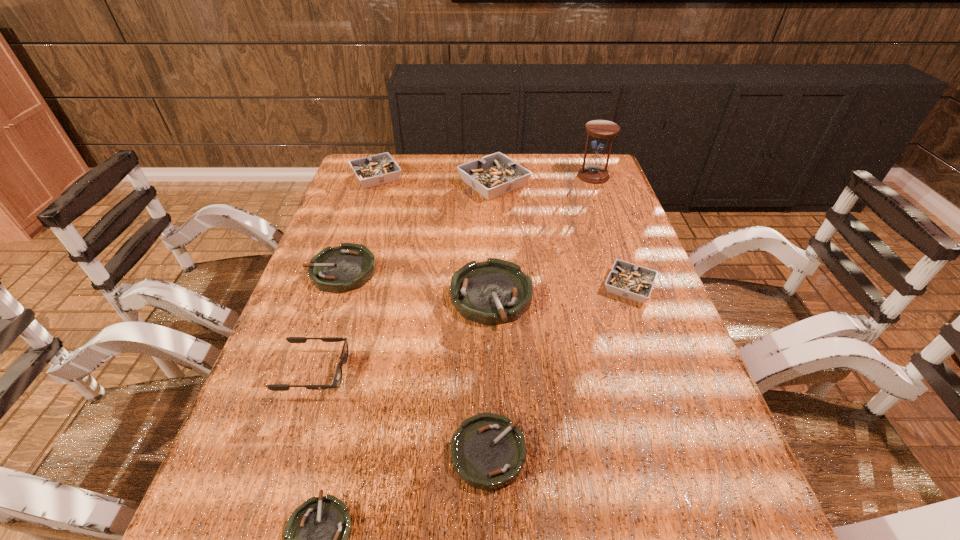
Find the location of a particular element. The height and width of the screenshot is (540, 960). hourglass at the right edge is located at coordinates (593, 172).

At what (x,y) coordinates should I click in order to perform the action: click on ashtray present at the right edge. Please return your answer as a coordinate pair (x, y). Looking at the image, I should click on (627, 280).

This screenshot has height=540, width=960. What are the coordinates of `object positioned at the far left corner` in the screenshot? It's located at (378, 169).

This screenshot has width=960, height=540. I want to click on object located at the far right corner, so click(x=593, y=172).

The image size is (960, 540). In the image, there is a desktop. Find the location of `vacant space at the far edge`. vacant space at the far edge is located at coordinates (441, 186).

The height and width of the screenshot is (540, 960). Identify the location of free space at the left edge of the desktop. point(307,446).

The width and height of the screenshot is (960, 540). In the image, there is a desktop. Find the location of `vacant area at the right edge`. vacant area at the right edge is located at coordinates (627, 262).

What are the coordinates of `vacant space at the far left corner of the desktop` in the screenshot? It's located at (391, 184).

In the image, there is a desktop. At what (x,y) coordinates should I click in order to perform the action: click on vacant space at the far right corner. Please return your answer as a coordinate pair (x, y). Image resolution: width=960 pixels, height=540 pixels. Looking at the image, I should click on (579, 161).

At what (x,y) coordinates should I click in order to perform the action: click on vacant area that lies between the eighth shortest object and the sunglasses. Please return your answer as a coordinate pair (x, y). Looking at the image, I should click on (404, 278).